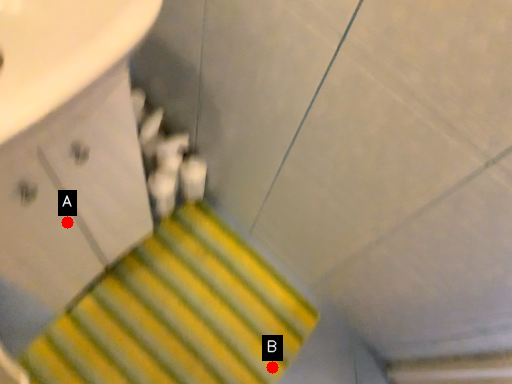
Question: Two points are circled on the image, labeled by A and B beside each circle. Which of the following is the farthest from the observer?

Choices:
 (A) A is further
 (B) B is further

Answer: (B)